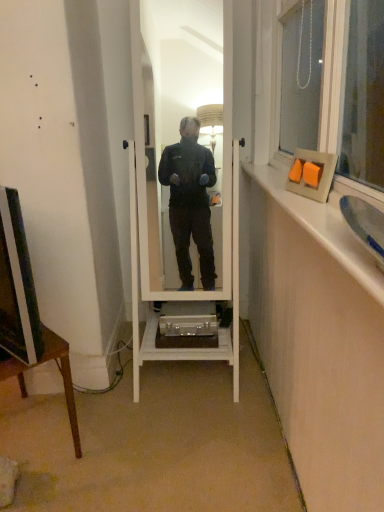
Question: From the image's perspective, is matte black television at left located above or below wooden frame at upper right?

Choices:
 (A) below
 (B) above

Answer: (A)

Question: Looking at their shapes, would you say matte black television at left is wider or thinner than wooden frame at upper right?

Choices:
 (A) thin
 (B) wide

Answer: (A)

Question: Estimate the real-world distances between objects in this image. Which object is closer to the wooden frame at upper right?

Choices:
 (A) white wooden mirror at center
 (B) matte black television at left
 (C) matte orange picture frame at upper right
 (D) brown wooden desk at lower left

Answer: (C)

Question: Which object is positioned farthest from the white wooden mirror at center?

Choices:
 (A) wooden frame at upper right
 (B) matte black television at left
 (C) brown wooden desk at lower left
 (D) matte orange picture frame at upper right

Answer: (B)